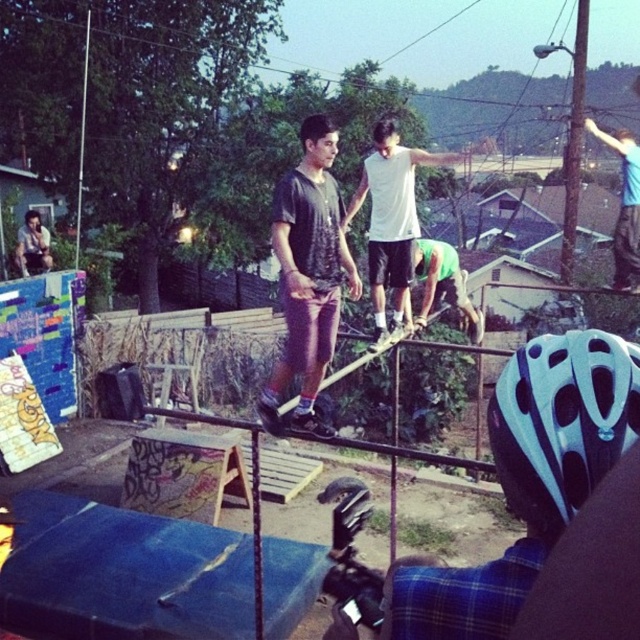
You are a photographer at the skatepark and want to capture a photo of the matte black shirt at center and the white matte shirt at center. Which one is positioned to the left of the other?

The matte black shirt at center is positioned on the left side of white matte shirt at center.

You are at the skatepark and want to take a photo of the two points mentioned. Which point, point (291,378) or point (396,296), will appear larger in your camera view?

Point (291,378) is closer to the camera than point (396,296), so it will appear larger in the camera view.

Consider the image. You are a photographer at the skatepark and want to capture both the white matte shirt at center and the green matte shirt at center in a single frame. Which person should you focus on to ensure both are visible without cropping?

The white matte shirt at center occupies less space than the green matte shirt at center, so focusing on the green matte shirt at center would allow both to be visible without cropping since it takes up more area in the frame.